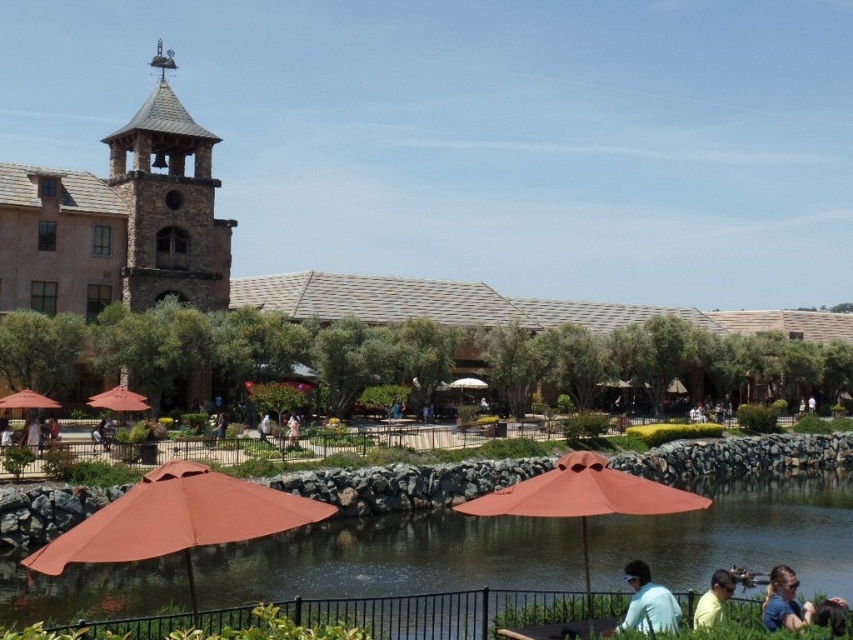
You are standing at the origin point in the image and want to walk to the brown fabric umbrella at lower left. According to the coordinates provided, in which direction should you move first?

The brown fabric umbrella at lower left is located at point 0.812 on the x and 0.209 on the y. Since you are at the origin, you should move right along the x axis first to reach the umbrella.